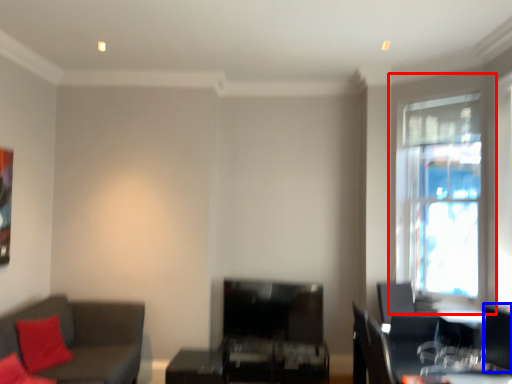
Question: Which point is closer to the camera, window (highlighted by a red box) or swivel chair (highlighted by a blue box)?

Choices:
 (A) window
 (B) swivel chair

Answer: (B)